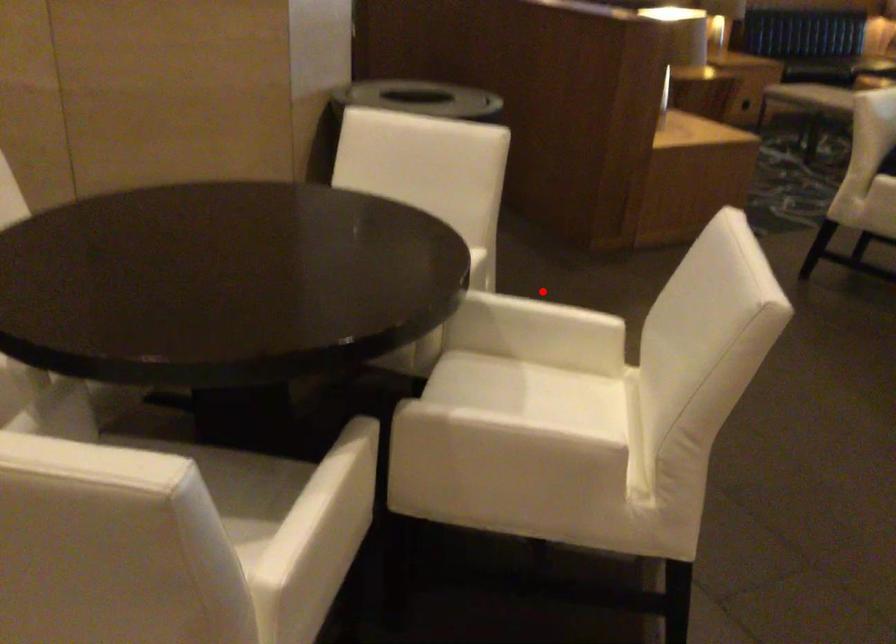
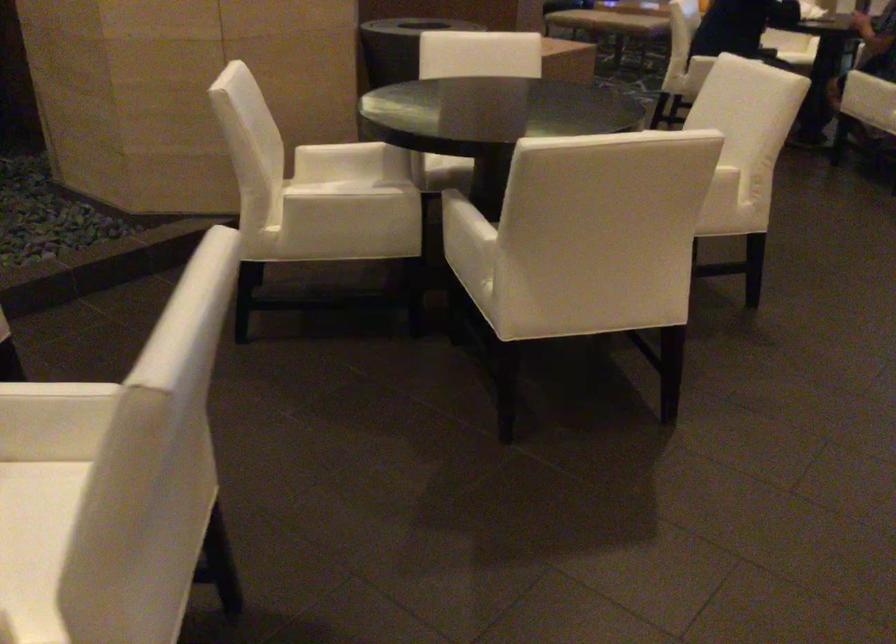
Question: I am providing you with two images of the same scene from different viewpoints. A red point is marked on the first image. At the location where the point appears in image 1, is it still visible in image 2?

Choices:
 (A) Yes
 (B) No

Answer: (B)